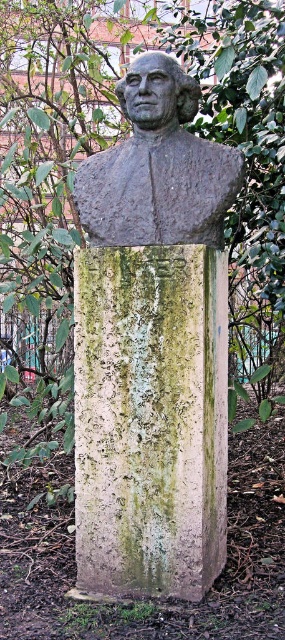
You are an art conservator examining the sculpture and its pedestal. From your vantage point, which object is closer to you between the green mossy stone pillar at center and the gray stone bust at center?

The green mossy stone pillar at center is closer to you because it is positioned in front of the gray stone bust at center.

You are an artist planning to create a miniature replica of the scene. You need to ensure the proportions between the green mossy stone pillar at center and the gray stone bust at center are accurate. Which object should have a smaller width in your model?

The green mossy stone pillar at center should be made smaller in width than the gray stone bust at center because the description states that the green mossy stone pillar at center is thinner than the gray stone bust at center.